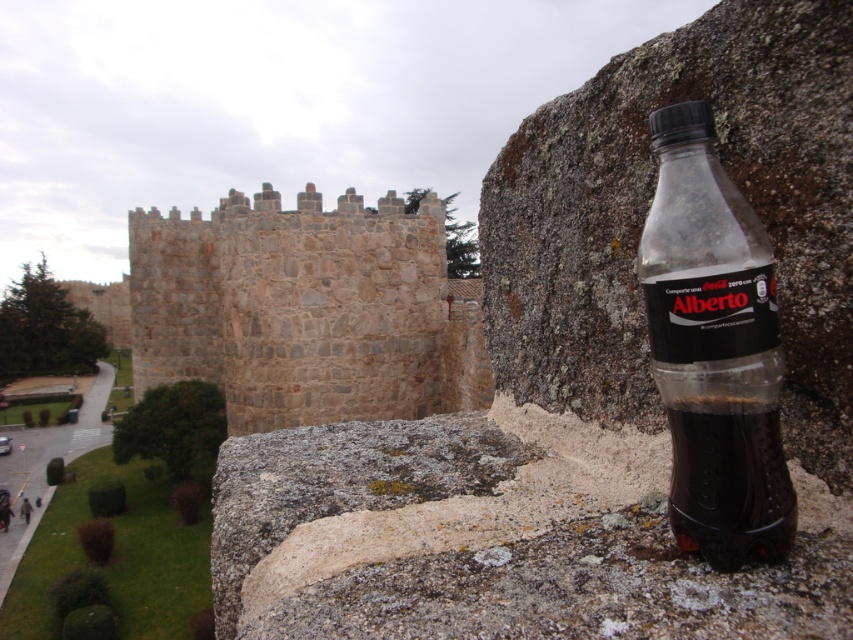
Between stone wall at center and translucent plastic bottle at right, which one appears on the right side from the viewer's perspective?

From the viewer's perspective, translucent plastic bottle at right appears more on the right side.

Is stone wall at center closer to camera compared to translucent plastic bottle at right?

No, stone wall at center is further to the viewer.

This screenshot has width=853, height=640. Identify the location of stone wall at center. (300, 308).

Identify the location of stone wall at center. Image resolution: width=853 pixels, height=640 pixels. (300, 308).